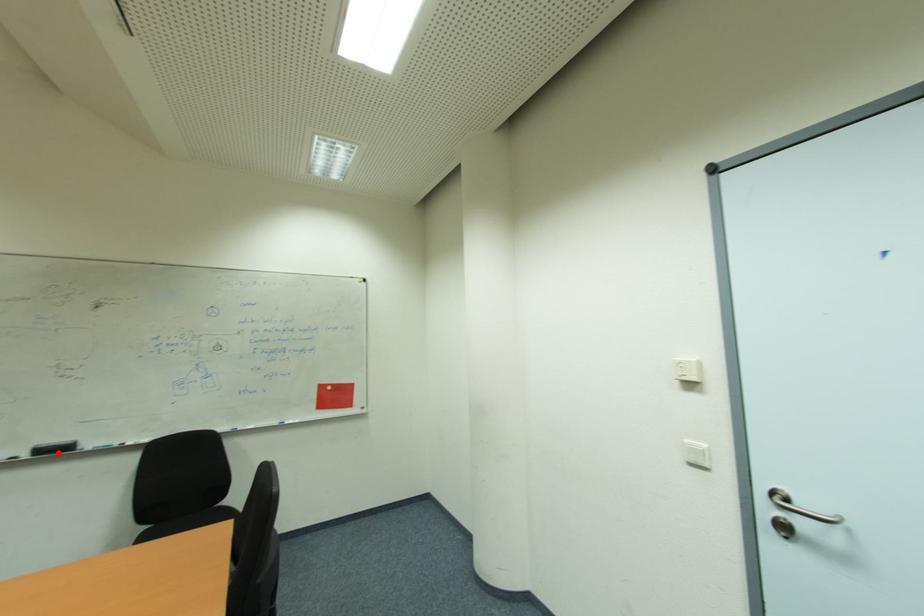
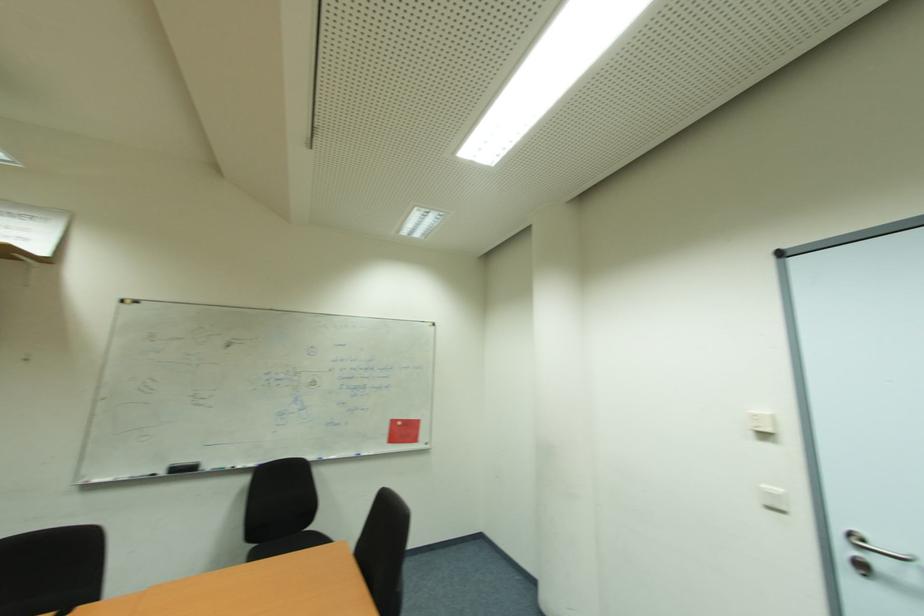
In the second image, find the point that corresponds to the highlighted location in the first image.

(189, 469)